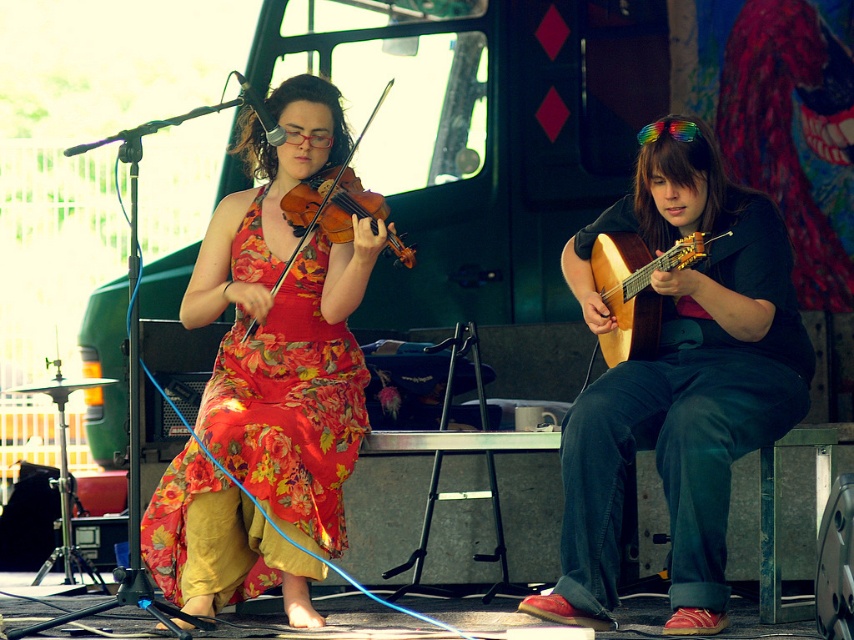
From the picture: Between floral fabric dress at center and matte wood violin at center, which one has less height?

matte wood violin at center is shorter.

Between point (196, 492) and point (287, 273), which one is positioned behind?

Positioned behind is point (287, 273).

Who is more distant from viewer, (247, 451) or (316, 218)?

The point (316, 218) is behind.

At what (x,y) coordinates should I click in order to perform the action: click on floral fabric dress at center. Please return your answer as a coordinate pair (x, y). Looking at the image, I should click on (285, 326).

Can you confirm if matte black guitar at center is positioned below matte wood violin at center?

Correct, matte black guitar at center is located below matte wood violin at center.

Consider the image. Is matte black guitar at center above matte wood violin at center?

Actually, matte black guitar at center is below matte wood violin at center.

I want to click on matte black guitar at center, so click(679, 381).

Can you confirm if floral fabric dress at center is smaller than wooden acoustic guitar at right?

No, floral fabric dress at center is not smaller than wooden acoustic guitar at right.

Locate an element on the screen. The width and height of the screenshot is (854, 640). floral fabric dress at center is located at coordinates (285, 326).

Between point (291, 241) and point (594, 272), which one is positioned in front?

Point (291, 241) is in front.

Image resolution: width=854 pixels, height=640 pixels. I want to click on floral fabric dress at center, so click(285, 326).